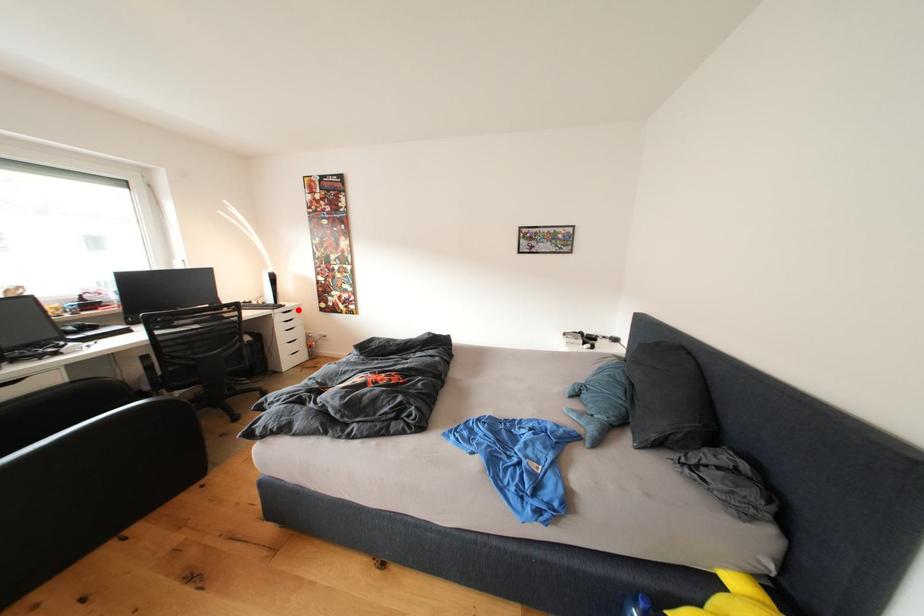
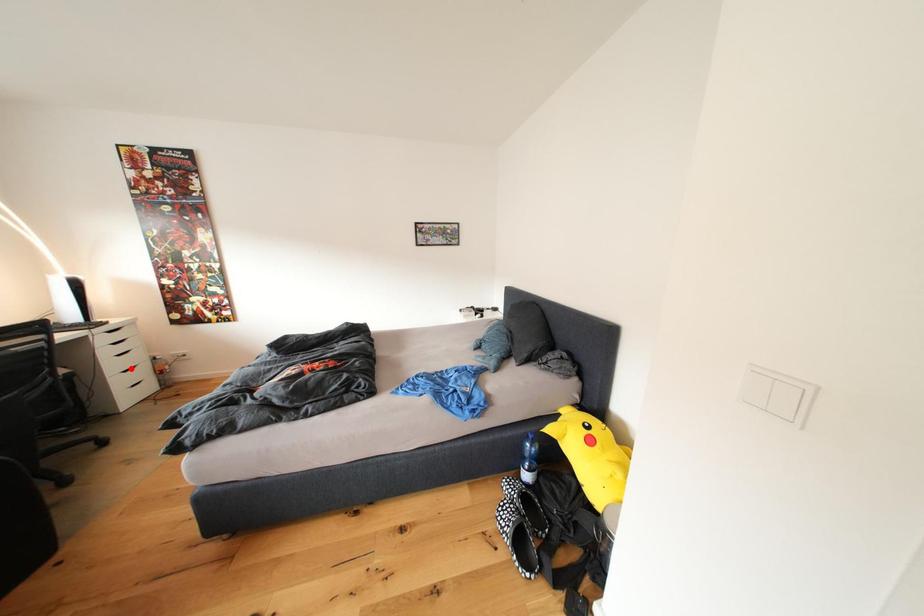
I am providing you with two images of the same scene from different viewpoints. A red point is marked on the first image and another point is marked on the second image. Does the point marked in image1 correspond to the same location as the one in image2?

No